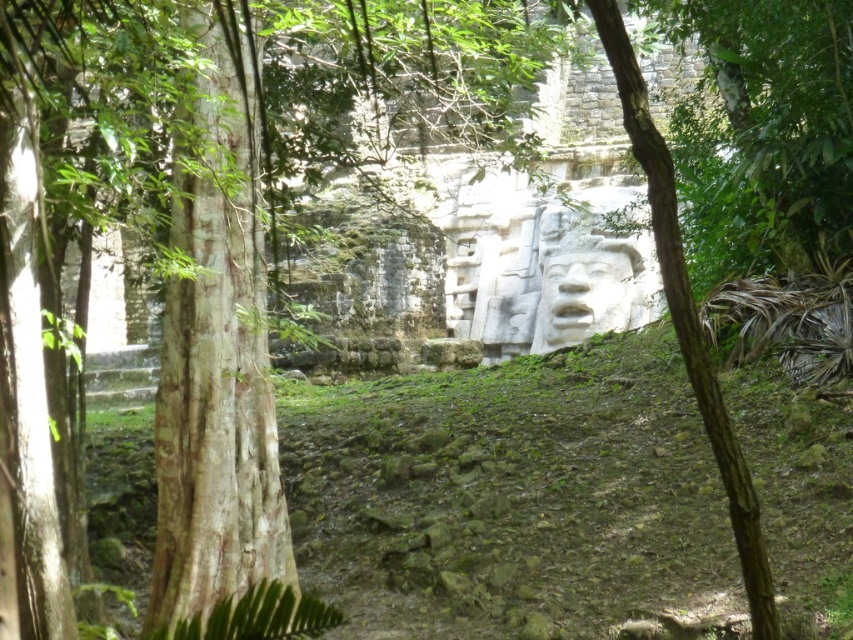
You are an archaeologist examining the ancient stone structure. You notice two white stone objects at the center of the scene. According to your map, the white stone carving at center is a newly discovered artifact, while the white stone face at center is a known historical feature. To determine their spatial relationship, which one is positioned to the right when viewed from your current position?

The white stone carving at center is to the right of the white stone face at center.

You are an archaeologist navigating through the dense forest to reach the white stone carving at center. Based on the coordinates provided, can you determine if the carving is positioned closer to the northern or southern part of the image?

The white stone carving at center is located at coordinates point (583,280). In standard image coordinate systems, the y value increases downward, so a lower y value indicates a higher position. Since 0.685 is closer to 1, which is the bottom of the image, the carving is positioned closer to the southern part of the image.